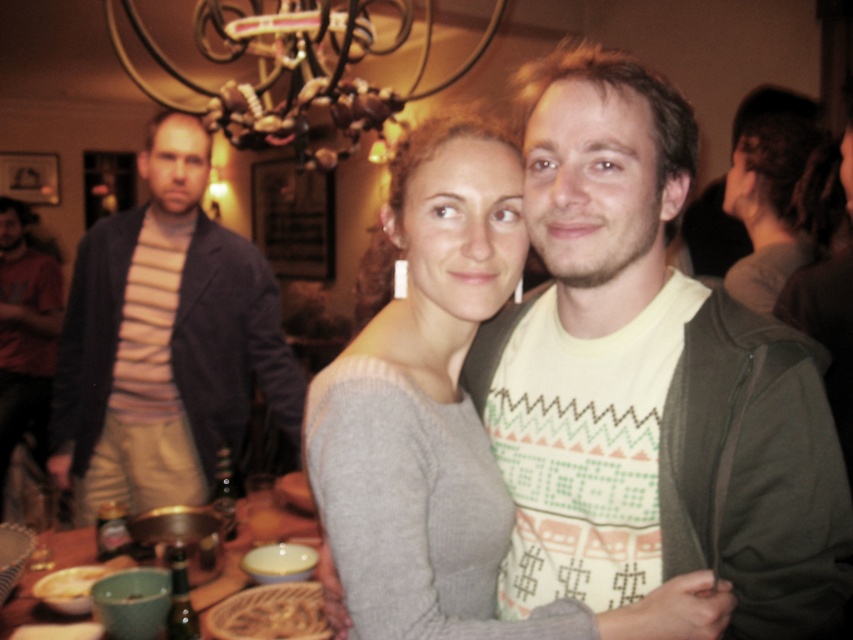
Question: Is knit sweater at center positioned at the back of wooden table at lower left?

Choices:
 (A) no
 (B) yes

Answer: (A)

Question: Does knit sweater at center lie behind smooth brown rice at center?

Choices:
 (A) no
 (B) yes

Answer: (A)

Question: Based on their relative distances, which object is farther from the wooden table at lower left?

Choices:
 (A) knit sweater at center
 (B) striped knit sweater at left

Answer: (A)

Question: Is knit sweater at center smaller than smooth brown rice at center?

Choices:
 (A) no
 (B) yes

Answer: (A)

Question: Which object is positioned farthest from the knit sweater at center?

Choices:
 (A) striped knit sweater at left
 (B) wooden table at lower left
 (C) smooth brown rice at center

Answer: (A)

Question: Which object is farther from the camera taking this photo?

Choices:
 (A) smooth brown rice at center
 (B) striped knit sweater at left
 (C) wooden table at lower left

Answer: (B)